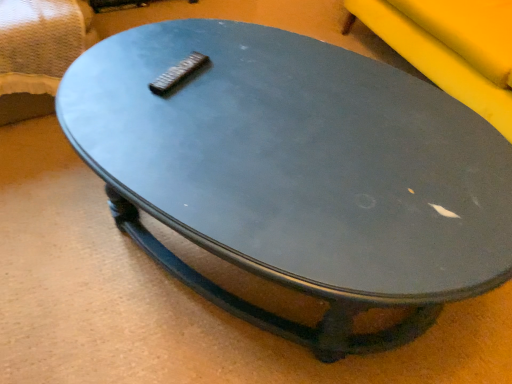
In order to click on unoccupied space behind black plastic remote at center in this screenshot , I will do `click(192, 43)`.